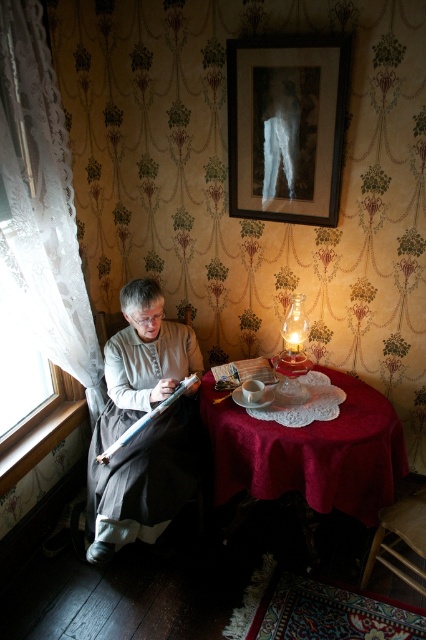
You are an interior designer planning to hang a new painting in this room. The wooden framed print at upper center and the gray woolen robe at left are already present. Which object is positioned higher on the wall?

The wooden framed print at upper center is located above the gray woolen robe at left, so it is positioned higher on the wall.

You are an interior designer planning to place a new painting on the wall in the room. The painting is 0.3 meters wide and needs to be placed to the right of the white lace curtain at left. Where should you position the painting?

The white lace curtain at left is located at point (42, 204). To place the painting to the right of it, position the painting at a point with an x coordinate greater than 0.320 but ensuring it stays within the room boundaries.